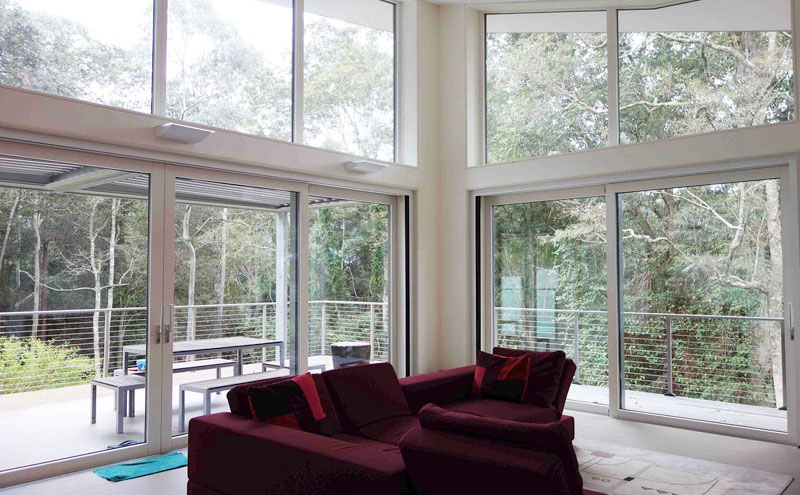
The height and width of the screenshot is (495, 800). Identify the location of table. (209, 347).